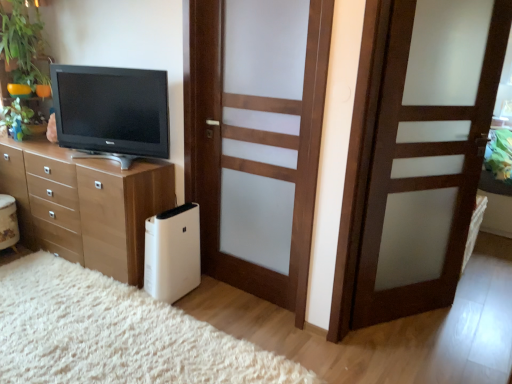
Question: Considering the relative sizes of white plastic air purifier at lower center and green glossy plant at upper left, placed as the 1th plant when sorted from bottom to top, in the image provided, is white plastic air purifier at lower center taller than green glossy plant at upper left, placed as the 1th plant when sorted from bottom to top,?

Choices:
 (A) no
 (B) yes

Answer: (B)

Question: Is white plastic air purifier at lower center placed right next to green glossy plant at upper left, the 2th plant in the top-to-bottom sequence?

Choices:
 (A) no
 (B) yes

Answer: (A)

Question: Considering the relative sizes of white plastic air purifier at lower center and green glossy plant at upper left, the 2th plant in the top-to-bottom sequence, in the image provided, is white plastic air purifier at lower center shorter than green glossy plant at upper left, the 2th plant in the top-to-bottom sequence,?

Choices:
 (A) no
 (B) yes

Answer: (A)

Question: From the image's perspective, is white plastic air purifier at lower center below green glossy plant at upper left, the 2th plant in the top-to-bottom sequence?

Choices:
 (A) yes
 (B) no

Answer: (A)

Question: Is white plastic air purifier at lower center not close to green glossy plant at upper left, the 2th plant in the top-to-bottom sequence?

Choices:
 (A) no
 (B) yes

Answer: (B)

Question: From a real-world perspective, is white plastic air purifier at lower center below green glossy plant at upper left, placed as the 1th plant when sorted from bottom to top?

Choices:
 (A) no
 (B) yes

Answer: (B)

Question: From a real-world perspective, is wooden door with frosted glass at center, marked as the 2th door in a right-to-left arrangement, positioned over green glossy plant at upper left, the 2th plant in the top-to-bottom sequence, based on gravity?

Choices:
 (A) yes
 (B) no

Answer: (B)

Question: From a real-world perspective, is wooden door with frosted glass at center, marked as the first door in a left-to-right arrangement, below green glossy plant at upper left, placed as the 1th plant when sorted from bottom to top?

Choices:
 (A) no
 (B) yes

Answer: (B)

Question: Could you tell me if wooden door with frosted glass at center, marked as the 2th door in a right-to-left arrangement, is facing green glossy plant at upper left, the 2th plant in the top-to-bottom sequence?

Choices:
 (A) yes
 (B) no

Answer: (B)

Question: Considering the relative sizes of wooden door with frosted glass at center, marked as the 2th door in a right-to-left arrangement, and green glossy plant at upper left, the 2th plant in the top-to-bottom sequence, in the image provided, is wooden door with frosted glass at center, marked as the 2th door in a right-to-left arrangement, smaller than green glossy plant at upper left, the 2th plant in the top-to-bottom sequence,?

Choices:
 (A) yes
 (B) no

Answer: (B)

Question: Is wooden door with frosted glass at center, marked as the first door in a left-to-right arrangement, wider than green glossy plant at upper left, the 2th plant in the top-to-bottom sequence?

Choices:
 (A) yes
 (B) no

Answer: (A)

Question: Does wooden door with frosted glass at center, marked as the first door in a left-to-right arrangement, have a lesser height compared to green glossy plant at upper left, the 2th plant in the top-to-bottom sequence?

Choices:
 (A) no
 (B) yes

Answer: (A)

Question: Does wooden door at center, acting as the first door starting from the right, have a greater width compared to wooden door with frosted glass at center, marked as the first door in a left-to-right arrangement?

Choices:
 (A) no
 (B) yes

Answer: (A)